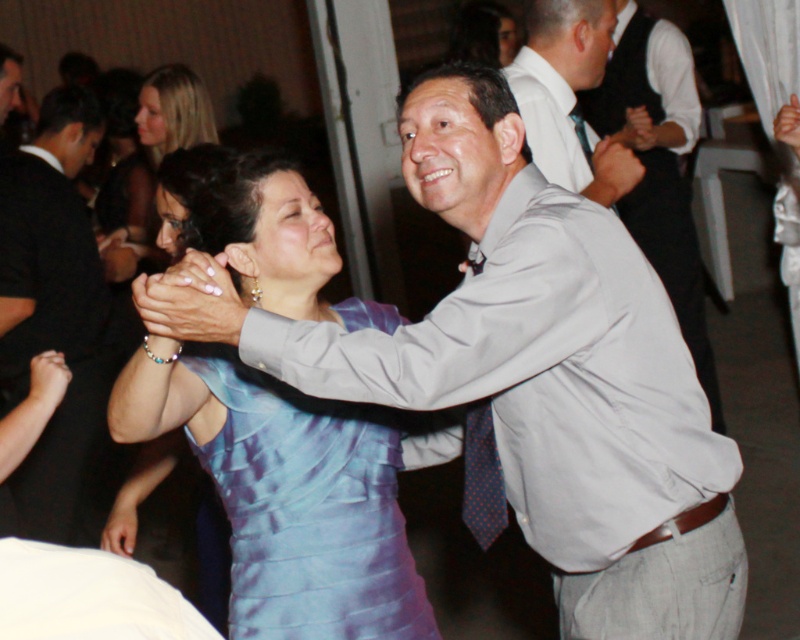
Question: Which point is farther to the camera?

Choices:
 (A) (144, 220)
 (B) (322, 518)
 (C) (652, 26)

Answer: (C)

Question: Which of the following is the closest to the observer?

Choices:
 (A) (90, 104)
 (B) (608, 6)
 (C) (692, 77)
 (D) (260, 515)

Answer: (D)

Question: Which point is farther to the camera?

Choices:
 (A) (218, 468)
 (B) (52, 120)
 (C) (150, 236)

Answer: (C)

Question: Is matte gray shirt at center further to camera compared to matte black suit at left?

Choices:
 (A) yes
 (B) no

Answer: (B)

Question: Where is matte gray shirt at center located in relation to gray fabric shirt at upper center in the image?

Choices:
 (A) right
 (B) left

Answer: (B)

Question: Can you confirm if satin blue dress at center is positioned above light gray shirt at upper right?

Choices:
 (A) no
 (B) yes

Answer: (A)